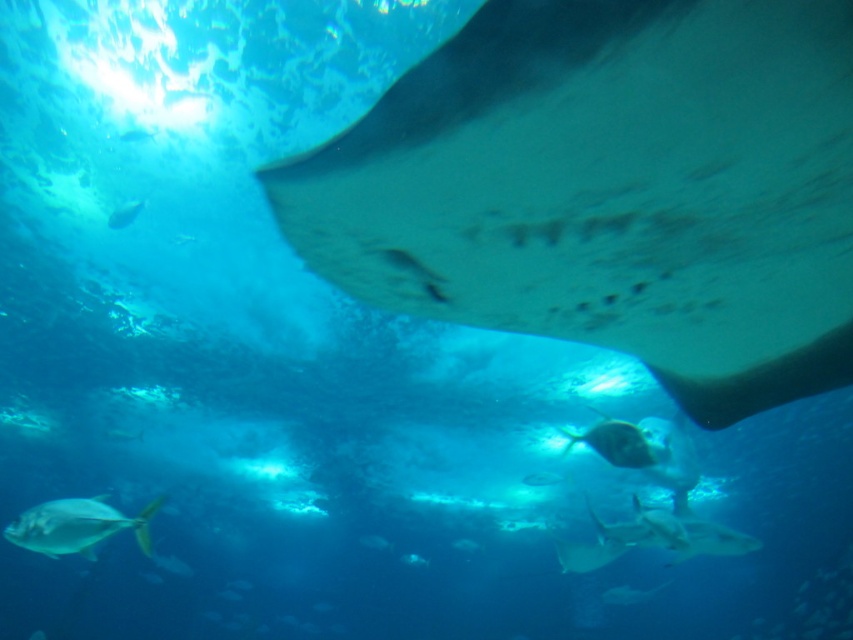
You are a marine biologist observing the aquarium. You need to locate the smooth gray stingray at upper right in the image. What are its coordinates?

The smooth gray stingray at upper right is located at coordinates (610, 189).

Based on the photo, you are an underwater photographer aiming to capture a closeup of the shiny silver fish at lower left and the shiny silver fish at upper left. Since you can only focus on one fish at a time, which fish should you choose to ensure the photo is in focus if your camera has a limited depth of field?

You should focus on the shiny silver fish at lower left because it is bigger than the shiny silver fish at upper left, so it will require a closer focus distance to maintain clarity.